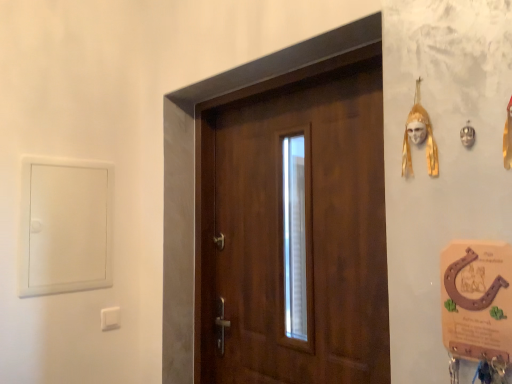
Question: Can you confirm if white plastic light switch at lower left is taller than gold metallic mask at upper right?

Choices:
 (A) no
 (B) yes

Answer: (A)

Question: Considering the relative sizes of white plastic light switch at lower left and gold metallic mask at upper right in the image provided, is white plastic light switch at lower left smaller than gold metallic mask at upper right?

Choices:
 (A) yes
 (B) no

Answer: (A)

Question: Is white plastic light switch at lower left next to gold metallic mask at upper right?

Choices:
 (A) no
 (B) yes

Answer: (A)

Question: Is the position of white plastic light switch at lower left less distant than that of gold metallic mask at upper right?

Choices:
 (A) yes
 (B) no

Answer: (B)

Question: Can you confirm if white plastic light switch at lower left is bigger than gold metallic mask at upper right?

Choices:
 (A) no
 (B) yes

Answer: (A)

Question: From the image's perspective, is white plastic light switch at lower left located above or below gold metallic mask at upper right?

Choices:
 (A) below
 (B) above

Answer: (A)

Question: From a real-world perspective, is white plastic light switch at lower left positioned above or below gold metallic mask at upper right?

Choices:
 (A) below
 (B) above

Answer: (A)

Question: Looking at their shapes, would you say white plastic light switch at lower left is wider or thinner than gold metallic mask at upper right?

Choices:
 (A) thin
 (B) wide

Answer: (A)

Question: Considering the positions of white plastic light switch at lower left and gold metallic mask at upper right in the image, is white plastic light switch at lower left bigger or smaller than gold metallic mask at upper right?

Choices:
 (A) big
 (B) small

Answer: (B)

Question: From a real-world perspective, relative to wooden door at center, is white plastic light switch at lower left vertically above or below?

Choices:
 (A) below
 (B) above

Answer: (A)

Question: Considering the positions of white plastic light switch at lower left and wooden door at center in the image, is white plastic light switch at lower left wider or thinner than wooden door at center?

Choices:
 (A) thin
 (B) wide

Answer: (A)

Question: Would you say white plastic light switch at lower left is inside or outside wooden door at center?

Choices:
 (A) inside
 (B) outside

Answer: (B)

Question: Is point (112, 309) closer or farther from the camera than point (365, 140)?

Choices:
 (A) farther
 (B) closer

Answer: (A)

Question: Considering the positions of gold metallic mask at upper right and wooden door at center in the image, is gold metallic mask at upper right wider or thinner than wooden door at center?

Choices:
 (A) wide
 (B) thin

Answer: (B)

Question: From the image's perspective, relative to wooden door at center, is gold metallic mask at upper right above or below?

Choices:
 (A) above
 (B) below

Answer: (A)